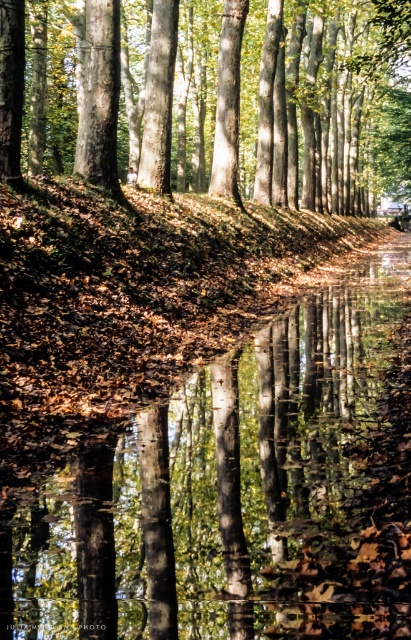
You are standing at the point labeled point (350,106) and want to walk towards the point labeled point (323,428). Which direction should you move to get closer to your destination?

You should move forward because point (323,428) is in front of point (350,106).

You are an artist planning to paint the scene. You want to ensure the brown reflective water at center and the smooth bark tree at center are proportionally accurate. Which object should you paint wider in your artwork?

The smooth bark tree at center should be painted wider since the brown reflective water at center has a lesser width compared to it.

You are standing at the edge of the forest and notice the brown reflective water at center. Based on its position, can you determine if it is closer to the foreground or the background of the image?

The brown reflective water at center is located at point (237,492), which places it closer to the foreground of the image.